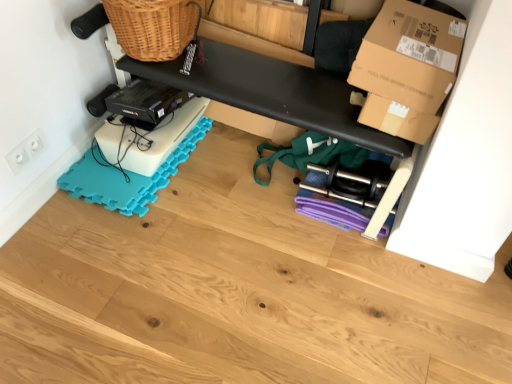
Question: Is brown cardboard box at upper right wider or thinner than black matte bench at upper center?

Choices:
 (A) thin
 (B) wide

Answer: (B)

Question: From the image's perspective, relative to black matte bench at upper center, is brown cardboard box at upper right above or below?

Choices:
 (A) below
 (B) above

Answer: (B)

Question: Considering the real-world distances, which object is closest to the brown cardboard box at upper right?

Choices:
 (A) teal foam yoga mat at lower left
 (B) black matte bench at upper center
 (C) wooden floor at lower center
 (D) white plastic electrical outlet at lower left

Answer: (B)

Question: Which object is positioned closest to the black matte bench at upper center?

Choices:
 (A) brown cardboard box at upper right
 (B) wooden floor at lower center
 (C) white plastic electrical outlet at lower left
 (D) teal foam yoga mat at lower left

Answer: (A)